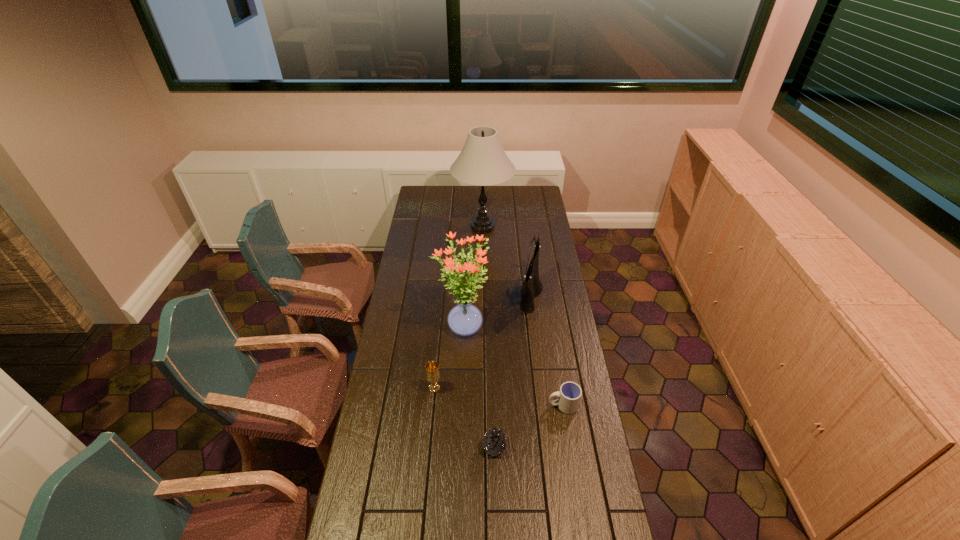
The image size is (960, 540). Identify the location of vacant space at the right edge of the desktop. (542, 234).

Identify the location of free space at the far left corner of the desktop. This screenshot has width=960, height=540. (421, 199).

Locate an element on the screen. This screenshot has width=960, height=540. unoccupied area between the tallest object and the third tallest object is located at coordinates (507, 261).

Identify the location of free space between the shoulder bag and the farthest object. (507, 261).

At what (x,y) coordinates should I click in order to perform the action: click on vacant point located between the fifth farthest object and the flower arrangement. Please return your answer as a coordinate pair (x, y). This screenshot has height=540, width=960. Looking at the image, I should click on (513, 367).

You are a GUI agent. You are given a task and a screenshot of the screen. Output one action in this format:
    pyautogui.click(x=<x>, y=<y>)
    Task: Click on the free spot between the nearest object and the second nearest object
    The height and width of the screenshot is (540, 960).
    Given the screenshot: What is the action you would take?
    pyautogui.click(x=529, y=426)

Identify the location of free area in between the pinecone and the fourth shortest object. This screenshot has width=960, height=540. (513, 371).

Find the location of a particular element. This screenshot has width=960, height=540. empty space that is in between the chalice and the cup is located at coordinates (499, 396).

Where is `object identified as the closest to the fifth farthest object`? The width and height of the screenshot is (960, 540). object identified as the closest to the fifth farthest object is located at coordinates (495, 442).

This screenshot has height=540, width=960. What are the coordinates of `object that is the closest to the shoulder bag` in the screenshot? It's located at (465, 319).